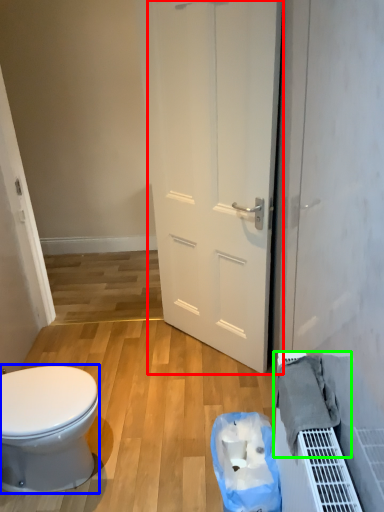
Question: Estimate the real-world distances between objects in this image. Which object is closer to door (highlighted by a red box), bidet (highlighted by a blue box) or material (highlighted by a green box)?

Choices:
 (A) bidet
 (B) material

Answer: (B)